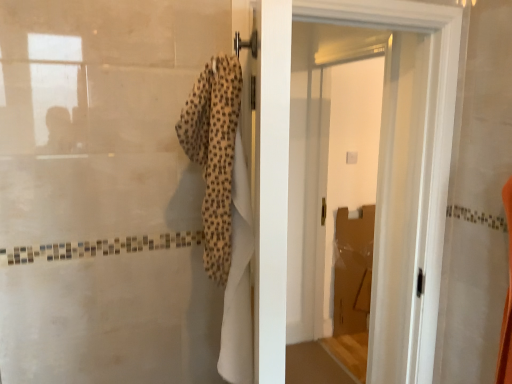
Question: From a real-world perspective, is beige textured towel at center on top of white glossy door at center?

Choices:
 (A) no
 (B) yes

Answer: (B)

Question: Does beige textured towel at center have a smaller size compared to white glossy door at center?

Choices:
 (A) no
 (B) yes

Answer: (B)

Question: Is the depth of beige textured towel at center greater than that of white glossy door at center?

Choices:
 (A) no
 (B) yes

Answer: (A)

Question: Does beige textured towel at center have a lesser height compared to white glossy door at center?

Choices:
 (A) no
 (B) yes

Answer: (B)

Question: Can you confirm if beige textured towel at center is bigger than white glossy door at center?

Choices:
 (A) no
 (B) yes

Answer: (A)

Question: Is beige textured towel at center at the left side of white glossy door at center?

Choices:
 (A) yes
 (B) no

Answer: (A)

Question: Could you tell me if white glossy door at center is facing beige textured towel at center?

Choices:
 (A) yes
 (B) no

Answer: (B)

Question: Is white glossy door at center shorter than beige textured towel at center?

Choices:
 (A) no
 (B) yes

Answer: (A)

Question: From a real-world perspective, is white glossy door at center physically below beige textured towel at center?

Choices:
 (A) no
 (B) yes

Answer: (B)

Question: From a real-world perspective, is white glossy door at center located higher than beige textured towel at center?

Choices:
 (A) no
 (B) yes

Answer: (A)

Question: From the image's perspective, is white glossy door at center on top of beige textured towel at center?

Choices:
 (A) yes
 (B) no

Answer: (B)

Question: Is the depth of white glossy door at center greater than that of beige textured towel at center?

Choices:
 (A) no
 (B) yes

Answer: (B)

Question: Is white glossy door at upper center at the back of beige textured towel at center?

Choices:
 (A) yes
 (B) no

Answer: (B)